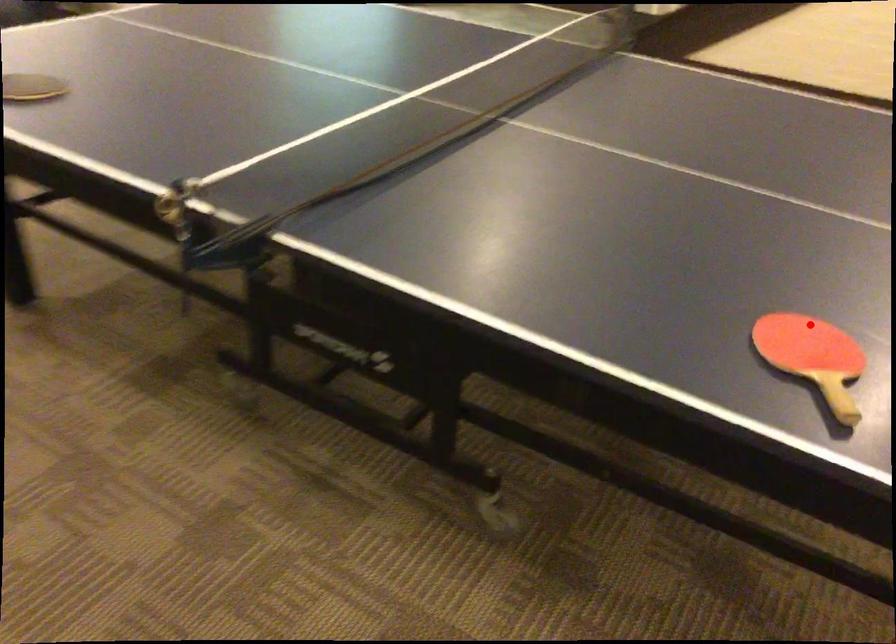
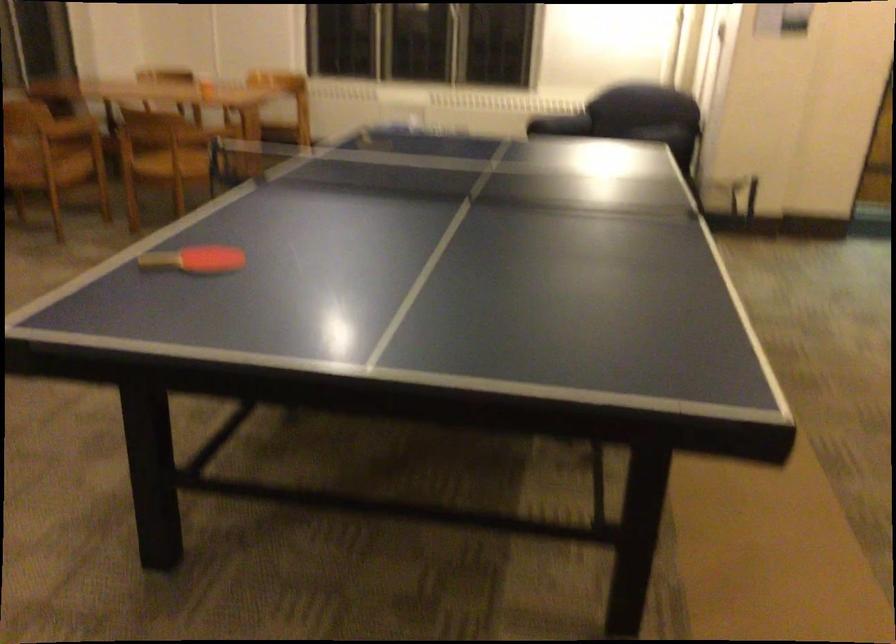
Question: I am providing you with two images of the same scene from different viewpoints. Given a red point in image1, look at the same physical point in image2. Is it:

Choices:
 (A) Closer to the viewpoint
 (B) Farther from the viewpoint

Answer: (B)